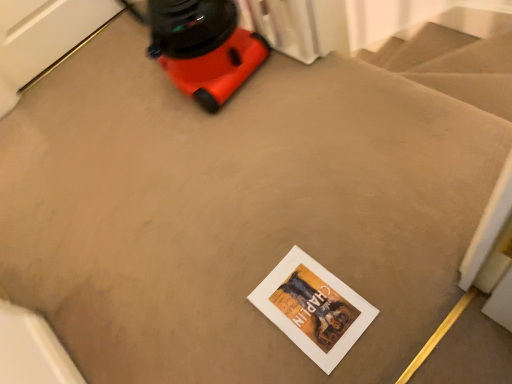
Where is `blank space above white matte postcard at center (from a real-world perspective)`? blank space above white matte postcard at center (from a real-world perspective) is located at coordinates (308, 304).